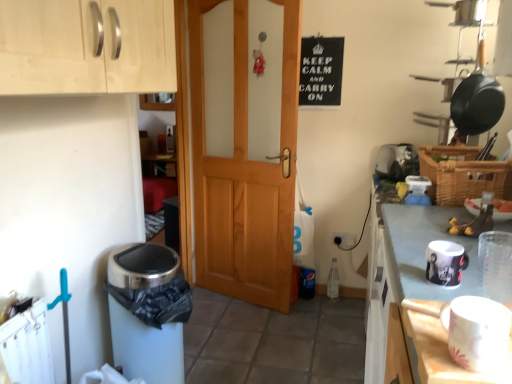
Where is `vacant region below wooden door at center (from a real-world perspective)`? The image size is (512, 384). vacant region below wooden door at center (from a real-world perspective) is located at coordinates (242, 294).